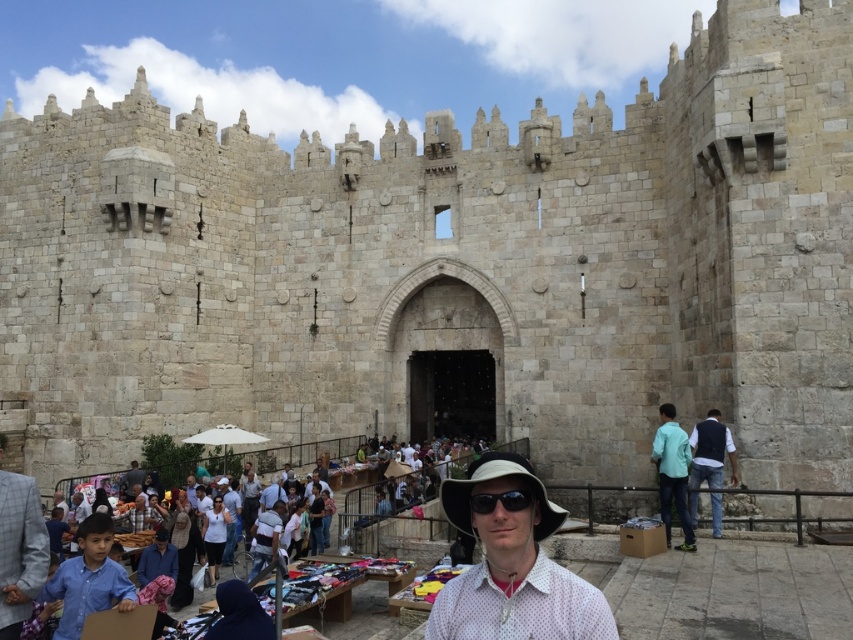
Is point (492, 493) positioned after point (123, 481)?

That is False.

Based on the photo, can you confirm if black plastic sunglasses at center is thinner than light brown leather jacket at lower left?

No.

Locate an element on the screen. This screenshot has width=853, height=640. black plastic sunglasses at center is located at coordinates (500, 500).

Between light blue shirt at center and light brown leather jacket at center, which one has less height?

Standing shorter between the two is light brown leather jacket at center.

Can you confirm if light blue shirt at center is smaller than light brown leather jacket at center?

No.

Does point (233, 548) come farther from viewer compared to point (262, 497)?

That is False.

This screenshot has width=853, height=640. Find the location of `light blue shirt at center`. light blue shirt at center is located at coordinates (231, 520).

Does black plastic sunglasses at center have a larger size compared to light brown leather jacket at center?

Yes, black plastic sunglasses at center is bigger than light brown leather jacket at center.

Does black plastic sunglasses at center lie behind light brown leather jacket at center?

No, it is in front of light brown leather jacket at center.

This screenshot has height=640, width=853. Identify the location of black plastic sunglasses at center. (500, 500).

The height and width of the screenshot is (640, 853). In order to click on black plastic sunglasses at center in this screenshot , I will do `click(500, 500)`.